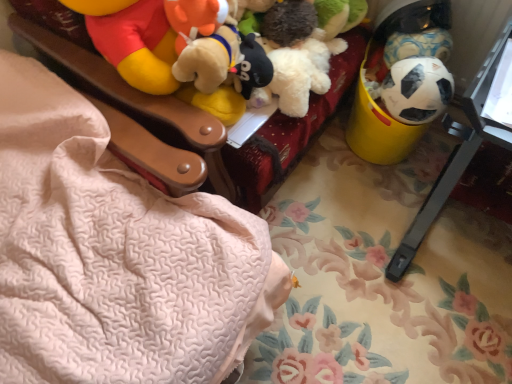
Question: Is black matte soccer ball at right, arranged as the second toy when viewed from the top, situated inside yellow plastic bucket at right or outside?

Choices:
 (A) inside
 (B) outside

Answer: (B)

Question: From the image's perspective, is black matte soccer ball at right, arranged as the second toy when viewed from the top, above or below yellow plastic bucket at right?

Choices:
 (A) below
 (B) above

Answer: (A)

Question: Which of these objects is positioned farthest from the yellow plastic changing table at right?

Choices:
 (A) white matte soccer ball at right, placed as the second toy when sorted from bottom to top
 (B) yellow plastic bucket at right
 (C) pink textured blanket at upper left
 (D) black matte soccer ball at right, the 1th toy positioned from the bottom

Answer: (C)

Question: Estimate the real-world distances between objects in this image. Which object is closer to the yellow plastic changing table at right?

Choices:
 (A) pink textured blanket at upper left
 (B) black matte soccer ball at right, the 1th toy positioned from the bottom
 (C) yellow plastic bucket at right
 (D) white matte soccer ball at right, which is the first toy in top-to-bottom order

Answer: (B)